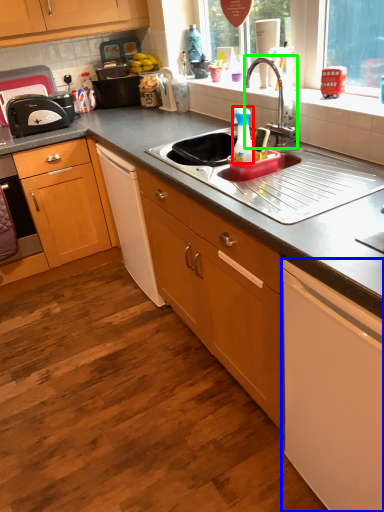
Question: Considering the real-world distances, which object is closest to bottle (highlighted by a red box)? cabinetry (highlighted by a blue box) or tap (highlighted by a green box).

Choices:
 (A) cabinetry
 (B) tap

Answer: (B)